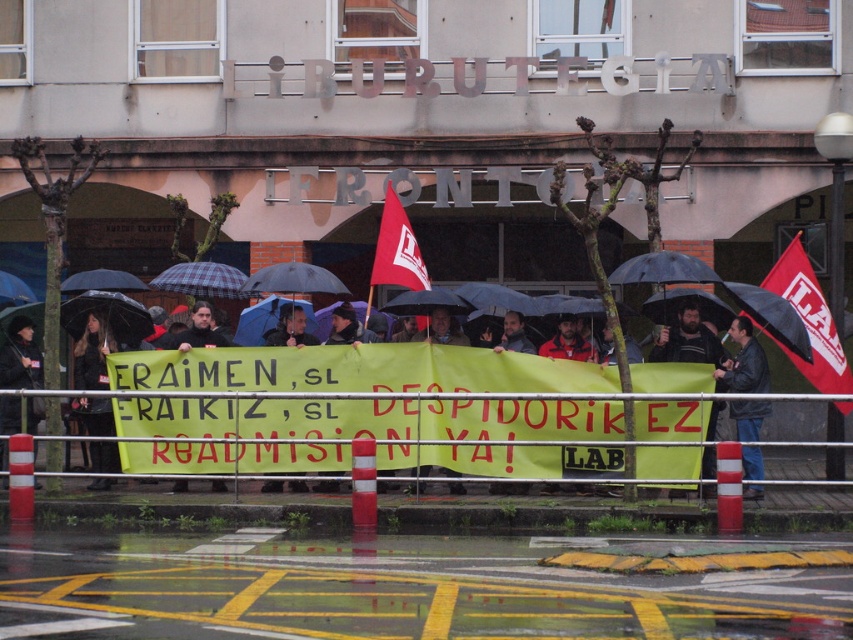
Question: Which point is closer to the camera?

Choices:
 (A) dark brown leather jacket at left
 (B) matte black jacket at center

Answer: (B)

Question: Based on their relative distances, which object is farther from the black leather jacket at right?

Choices:
 (A) red fabric flag at upper right
 (B) dark gray jacket at center

Answer: (A)

Question: Can you confirm if dark gray jacket at center is wider than matte black jacket at center?

Choices:
 (A) no
 (B) yes

Answer: (B)

Question: From the image, what is the correct spatial relationship of black leather jacket at center in relation to dark brown leather jacket at left?

Choices:
 (A) right
 (B) left

Answer: (A)

Question: Which object is closer to the camera taking this photo?

Choices:
 (A) red fabric flag at center
 (B) black leather jacket at right

Answer: (B)

Question: Can you confirm if dark gray jacket at center is smaller than red fabric flag at center?

Choices:
 (A) no
 (B) yes

Answer: (A)